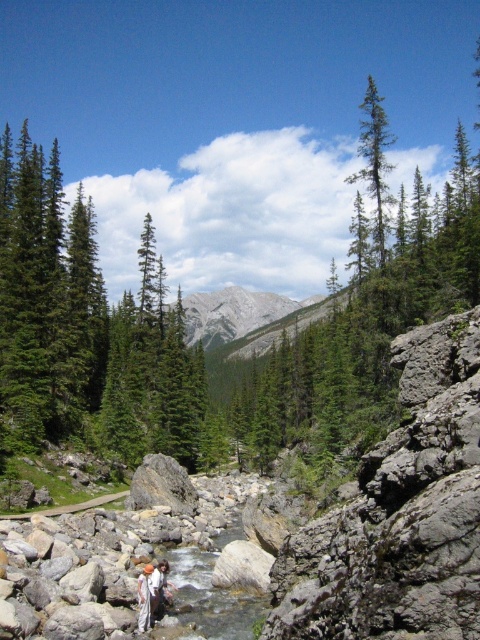
Is green matte tree at center wider than white cotton shirt at center?

Yes.

Does point (84, 253) come in front of point (147, 621)?

No, it is behind (147, 621).

At what (x,y) coordinates should I click in order to perform the action: click on green matte tree at center. Please return your answer as a coordinate pair (x, y). Looking at the image, I should click on click(x=86, y=330).

Is green matte evergreen tree at upper right thinner than white cotton shirt at center?

No.

Does green matte evergreen tree at upper right have a greater width compared to white cotton shirt at center?

Yes.

Between point (374, 221) and point (149, 611), which one is positioned in front?

Point (149, 611)

Where is `green matte evergreen tree at upper right`? The image size is (480, 640). green matte evergreen tree at upper right is located at coordinates point(374,157).

Who is taller, green matte tree at center or white cotton clothing at center?

With more height is green matte tree at center.

Describe the element at coordinates (86, 330) in the screenshot. I see `green matte tree at center` at that location.

Does point (118, 381) lie in front of point (153, 568)?

No.

What are the coordinates of `green matte tree at center` in the screenshot? It's located at point(86,330).